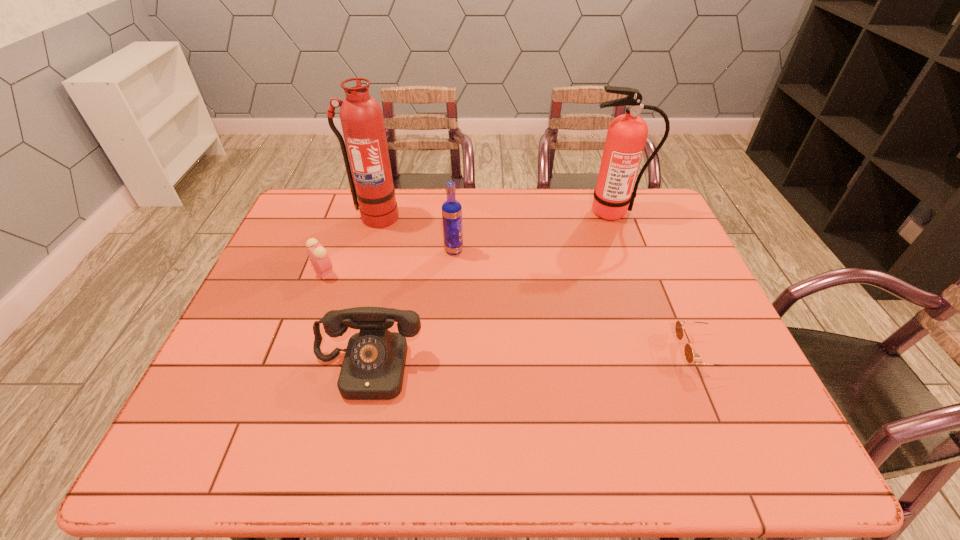
This screenshot has width=960, height=540. In order to click on vacant region located on the front of the vodka in this screenshot , I will do `click(448, 335)`.

The height and width of the screenshot is (540, 960). In order to click on vacant position located on the dial of the telephone in this screenshot , I will do `click(355, 422)`.

The width and height of the screenshot is (960, 540). I want to click on vacant space located on the face of the second shortest object, so click(465, 271).

Image resolution: width=960 pixels, height=540 pixels. I want to click on vacant space located 0.190m on the front lenses of the shortest object, so tap(600, 352).

The height and width of the screenshot is (540, 960). Identify the location of vacant point located 0.270m on the front lenses of the shortest object. (567, 352).

Find the location of a particular element. free space located on the front lenses of the shortest object is located at coordinates (654, 352).

Find the location of a particular element. The width and height of the screenshot is (960, 540). object present at the left edge is located at coordinates (317, 254).

You are a GUI agent. You are given a task and a screenshot of the screen. Output one action in this format:
    pyautogui.click(x=<x>, y=<y>)
    Task: Click on the fire extinguisher located at the right edge
    
    Given the screenshot: What is the action you would take?
    pyautogui.click(x=627, y=134)

In order to click on sunglasses that is positioned at the right edge in this screenshot , I will do `click(688, 351)`.

Image resolution: width=960 pixels, height=540 pixels. I want to click on object present at the far right corner, so click(x=627, y=134).